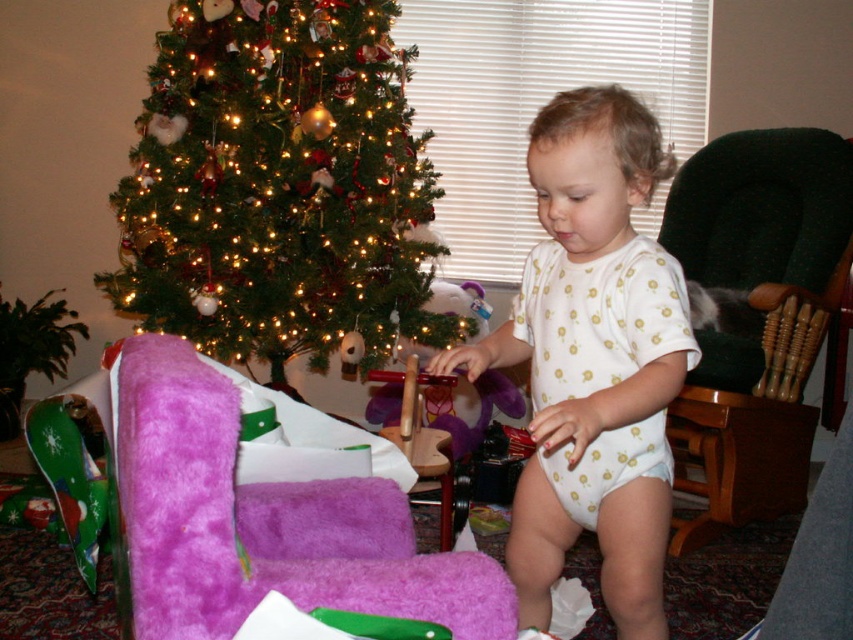
Between green matte christmas tree at upper left and green felt tree at left, which one has more height?

Standing taller between the two is green matte christmas tree at upper left.

Who is more distant from viewer, [170,58] or [62,307]?

The point [62,307] is more distant.

Does point (241, 218) come farther from viewer compared to point (53, 362)?

That is False.

Find the location of a particular element. green matte christmas tree at upper left is located at coordinates (277, 186).

From the picture: Is green matte christmas tree at upper left wider than green fabric armchair at right?

Indeed, green matte christmas tree at upper left has a greater width compared to green fabric armchair at right.

Does green matte christmas tree at upper left have a smaller size compared to green fabric armchair at right?

Actually, green matte christmas tree at upper left might be larger than green fabric armchair at right.

Find the location of a particular element. green matte christmas tree at upper left is located at coordinates (277, 186).

From the picture: Does green fabric armchair at right appear on the left side of green felt tree at left?

No, green fabric armchair at right is not to the left of green felt tree at left.

Which is more to the right, green fabric armchair at right or green felt tree at left?

Positioned to the right is green fabric armchair at right.

The image size is (853, 640). What do you see at coordinates (758, 310) in the screenshot? I see `green fabric armchair at right` at bounding box center [758, 310].

The width and height of the screenshot is (853, 640). I want to click on green fabric armchair at right, so click(758, 310).